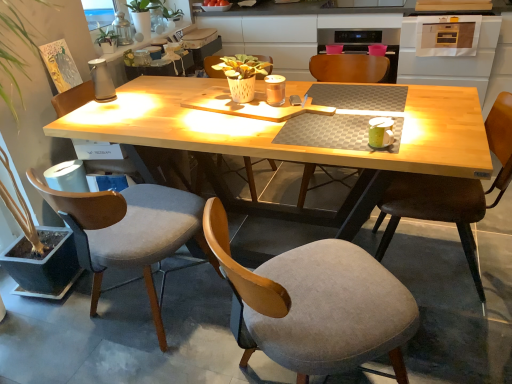
Question: From a real-world perspective, is wooden chair at center, the third chair when ordered from left to right, physically located above or below green matte coffee cup at upper right?

Choices:
 (A) above
 (B) below

Answer: (B)

Question: Relative to green matte coffee cup at upper right, is wooden chair at center, the third chair when ordered from left to right, in front or behind?

Choices:
 (A) behind
 (B) front

Answer: (A)

Question: Which object is the farthest from the velvet grey chair at left, which appears as the 5th chair when viewed from the right?

Choices:
 (A) gray fabric chair at left, the 6th chair from the right
 (B) green matte plant at upper left, acting as the 1th houseplant starting from the bottom
 (C) brown leather chair at right, acting as the first chair starting from the right
 (D) matte wooden chair at center, which is the 5th chair from left to right
 (E) green matte coffee cup at upper right

Answer: (B)

Question: Which object is positioned farthest from the gray fabric chair at lower center, the 4th chair in the left-to-right sequence?

Choices:
 (A) matte wooden chair at center, the 2th chair from the right
 (B) green matte coffee cup at upper right
 (C) wooden chair at center, marked as the 4th chair in a right-to-left arrangement
 (D) brown leather chair at right, the 6th chair positioned from the left
 (E) gray fabric chair at left, which is the 1th chair in left-to-right order

Answer: (C)